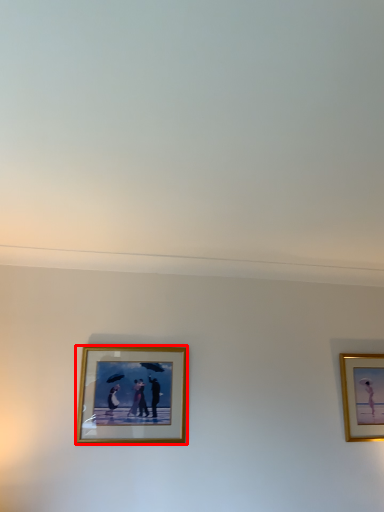
Question: From the image's perspective, what is the correct spatial relationship of picture frame (annotated by the red box) in relation to picture frame?

Choices:
 (A) below
 (B) above

Answer: (B)